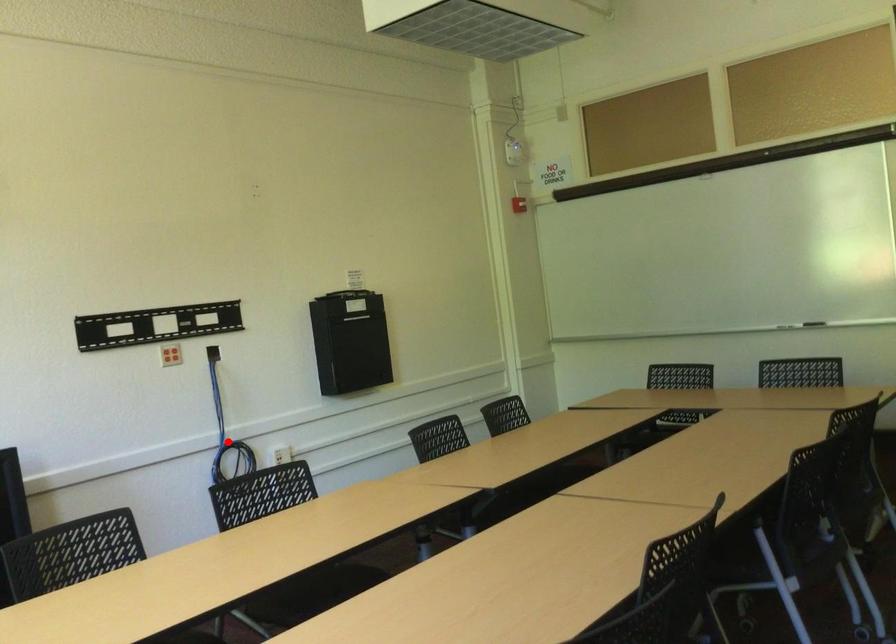
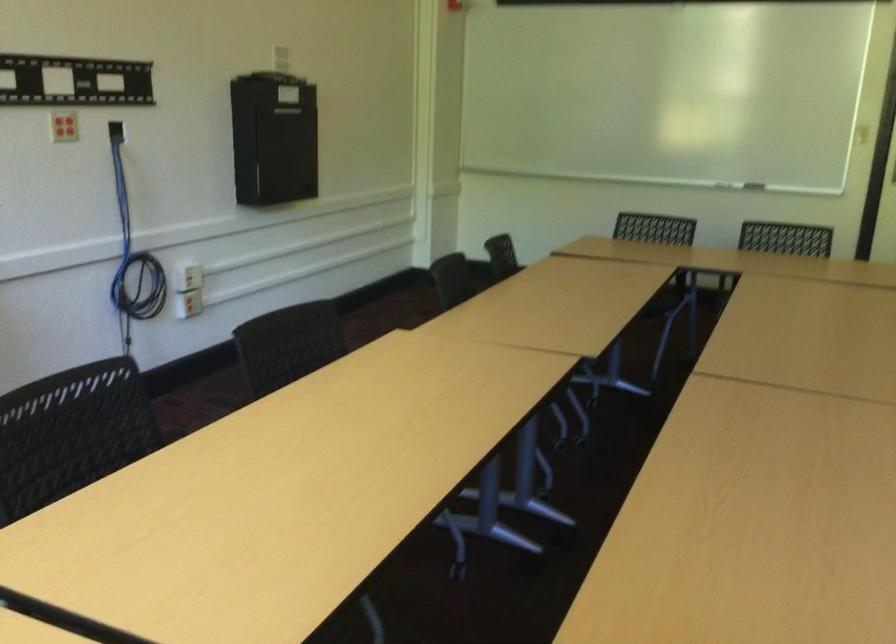
The point at the highlighted location is marked in the first image. Where is the corresponding point in the second image?

(133, 252)